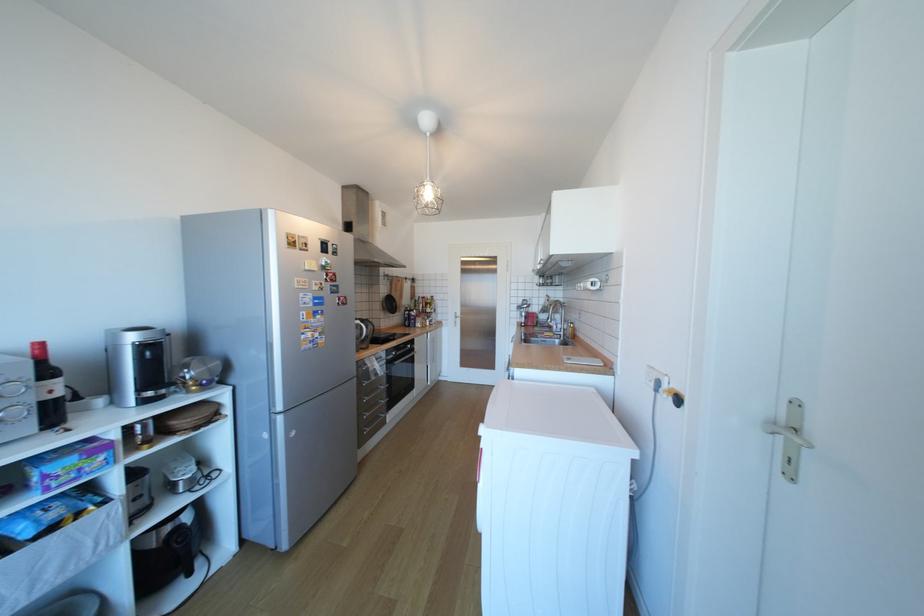
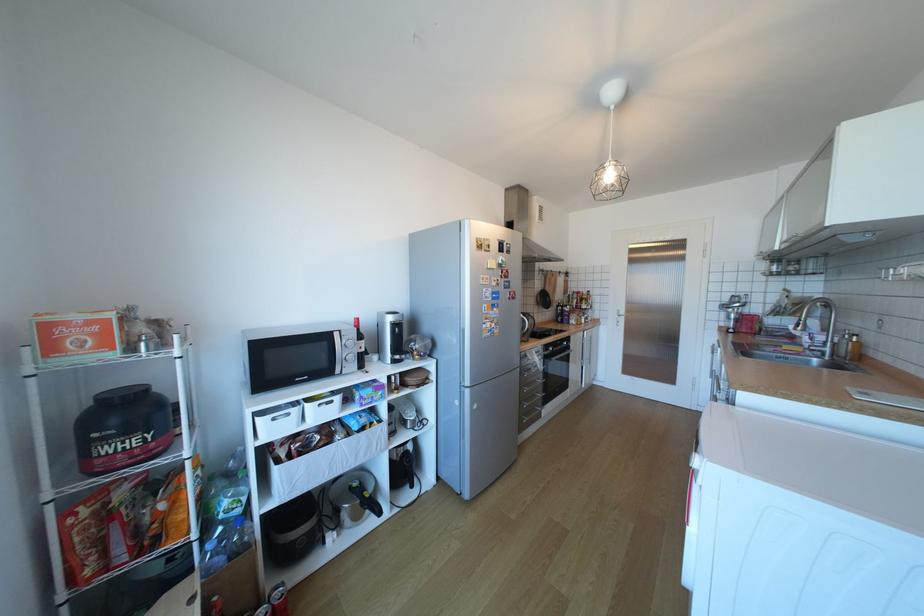
Where in the second image is the point corresponding to [396,400] from the first image?

(553, 395)